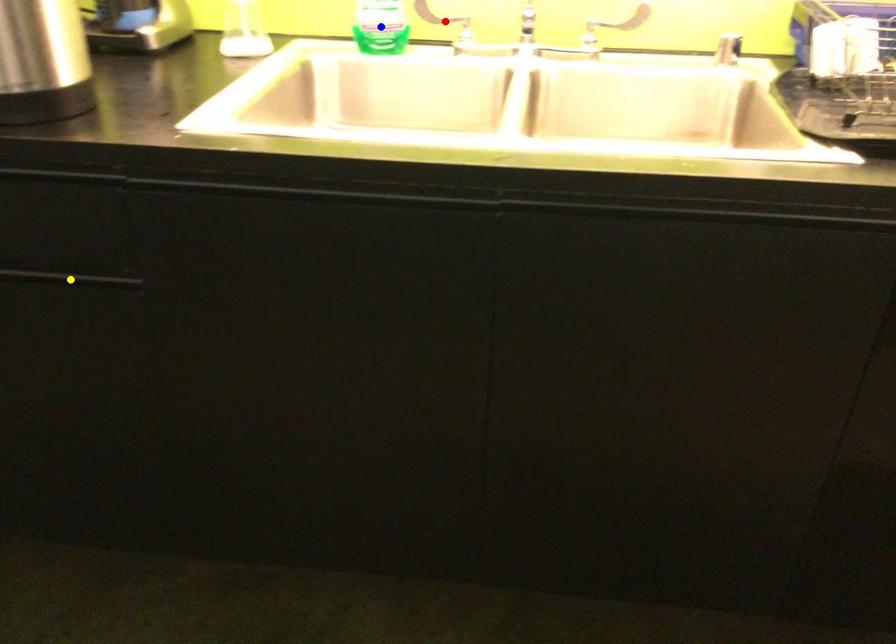
Order these from nearest to farthest:
1. blue point
2. yellow point
3. red point

yellow point → blue point → red point